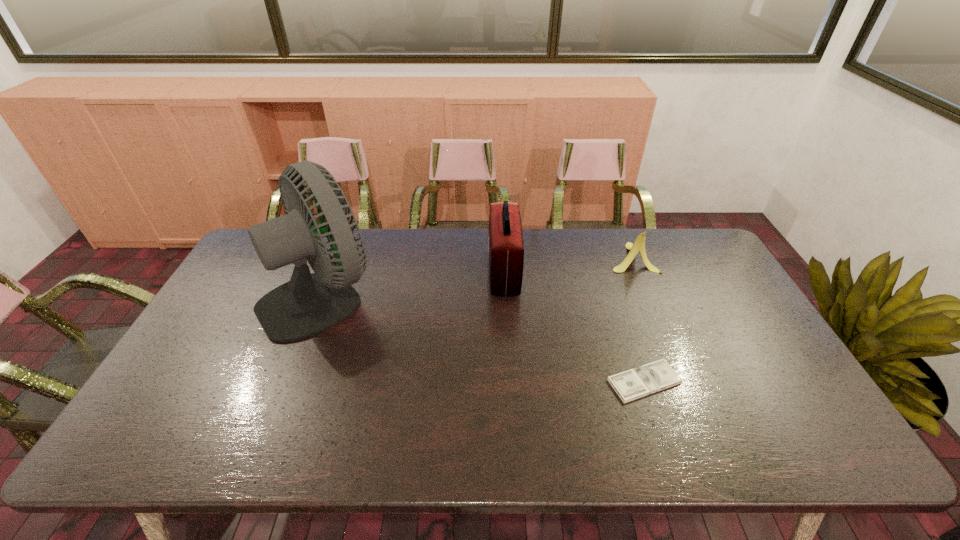
Find the location of a particular element. vacant space located 0.110m on the side of the first aid kit with the cross symbol is located at coordinates (455, 272).

Locate an element on the screen. Image resolution: width=960 pixels, height=540 pixels. vacant area situated 0.160m on the left of the third tallest object is located at coordinates (562, 258).

Identify the location of vacant space located on the right of the shortest object. The image size is (960, 540). (785, 381).

This screenshot has height=540, width=960. Find the location of `fan located at the far edge`. fan located at the far edge is located at coordinates (308, 304).

Where is `the first aid kit that is positioned at the far edge`? The width and height of the screenshot is (960, 540). the first aid kit that is positioned at the far edge is located at coordinates (506, 247).

In order to click on banana present at the far edge in this screenshot , I will do `click(639, 245)`.

Locate an element on the screen. This screenshot has width=960, height=540. object that is at the left edge is located at coordinates (308, 304).

Where is `object present at the far left corner`? This screenshot has width=960, height=540. object present at the far left corner is located at coordinates (308, 304).

This screenshot has height=540, width=960. In order to click on vacant space at the far edge of the desktop in this screenshot , I will do `click(529, 233)`.

At what (x,y) coordinates should I click in order to perform the action: click on blank area at the near edge. Please return your answer as a coordinate pair (x, y). Looking at the image, I should click on (295, 450).